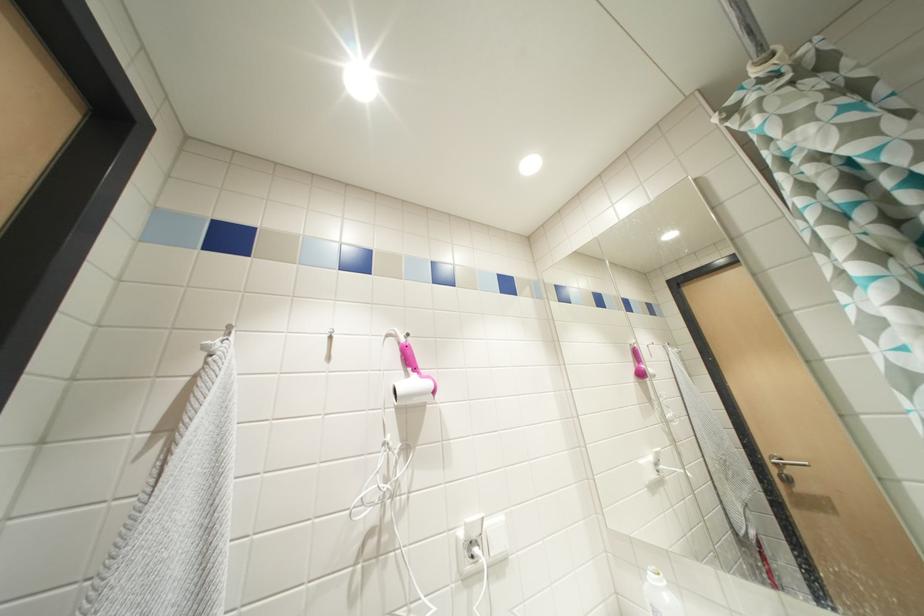
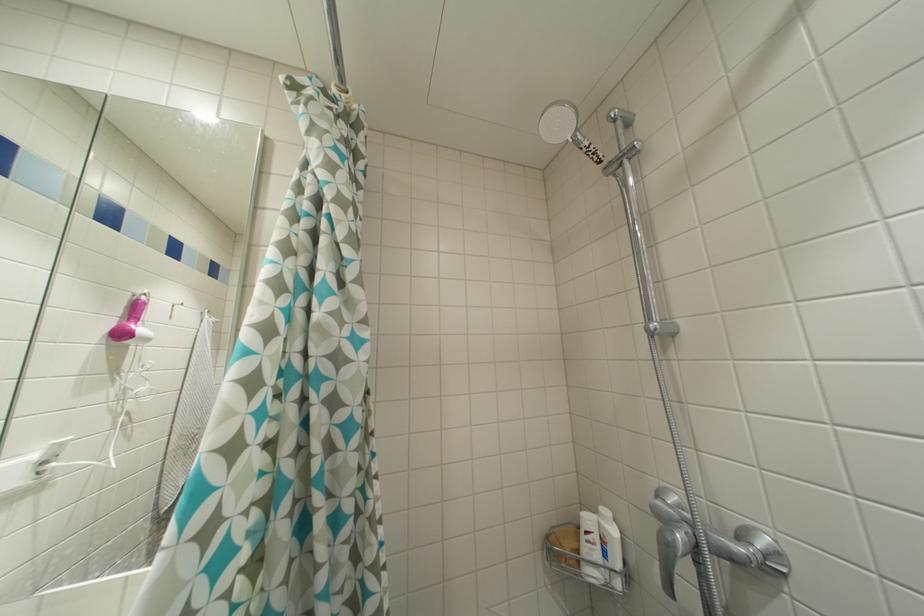
Question: The camera is either moving clockwise (left) or counter-clockwise (right) around the object. The first image is from the beginning of the video and the second image is from the end. Is the camera moving left or right when shooting the video?

Choices:
 (A) Left
 (B) Right

Answer: (A)